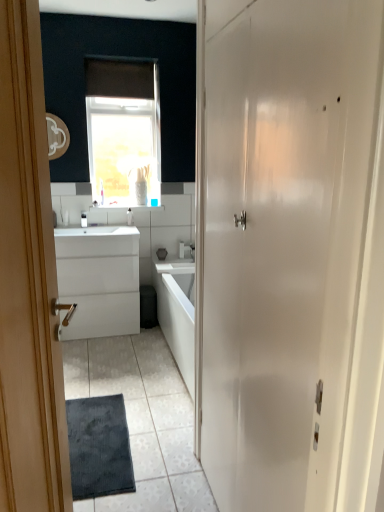
Where is `vacant area that is situated to the right of dark gray textured bath mat at lower center`? vacant area that is situated to the right of dark gray textured bath mat at lower center is located at coordinates (161, 442).